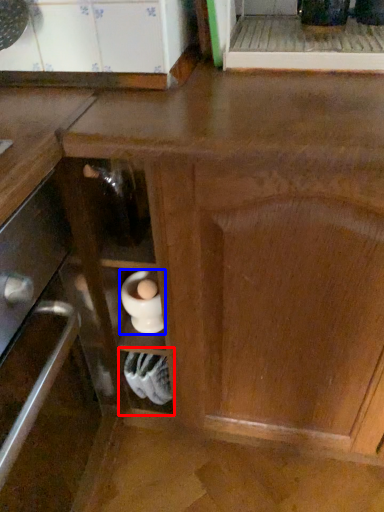
Question: Which object is closer to the camera taking this photo, shelf (highlighted by a red box) or appliance (highlighted by a blue box)?

Choices:
 (A) shelf
 (B) appliance

Answer: (B)